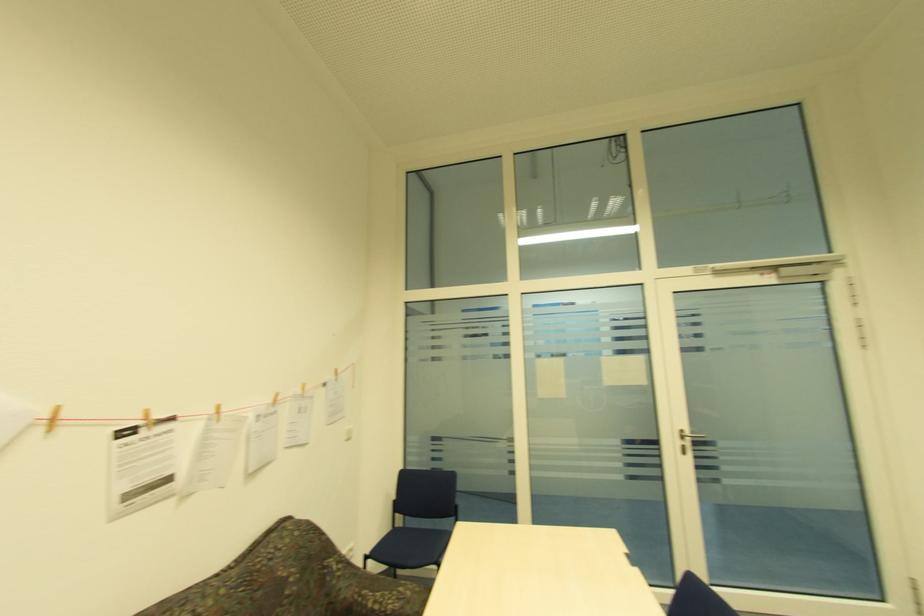
Find the location of a particular element. The height and width of the screenshot is (616, 924). blue chair sitting surface is located at coordinates (414, 543).